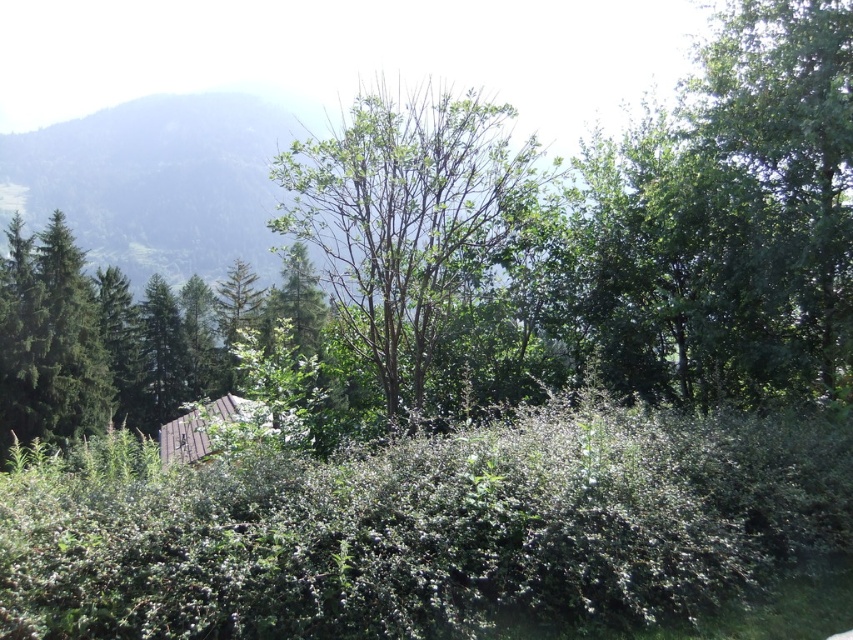
Question: Is green leafy hedge at center to the left of green leafy tree at center from the viewer's perspective?

Choices:
 (A) yes
 (B) no

Answer: (B)

Question: Does green leafy hedge at center have a lesser width compared to green leafy tree at center?

Choices:
 (A) yes
 (B) no

Answer: (A)

Question: Which point is closer to the camera taking this photo?

Choices:
 (A) (543, 600)
 (B) (488, 163)

Answer: (A)

Question: Which object is closer to the camera taking this photo?

Choices:
 (A) green leafy tree at center
 (B) green leafy hedge at center

Answer: (B)

Question: Does green leafy hedge at center lie behind green leafy tree at center?

Choices:
 (A) yes
 (B) no

Answer: (B)